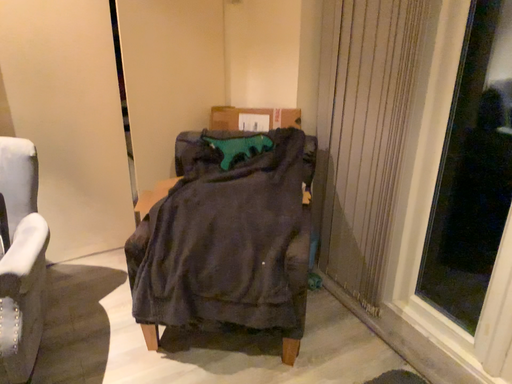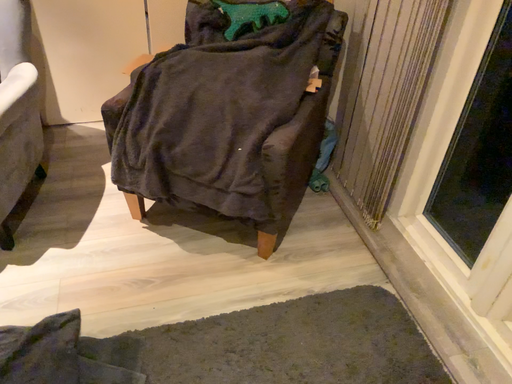
Question: Which way did the camera rotate in the video?

Choices:
 (A) rotated right
 (B) rotated left

Answer: (B)